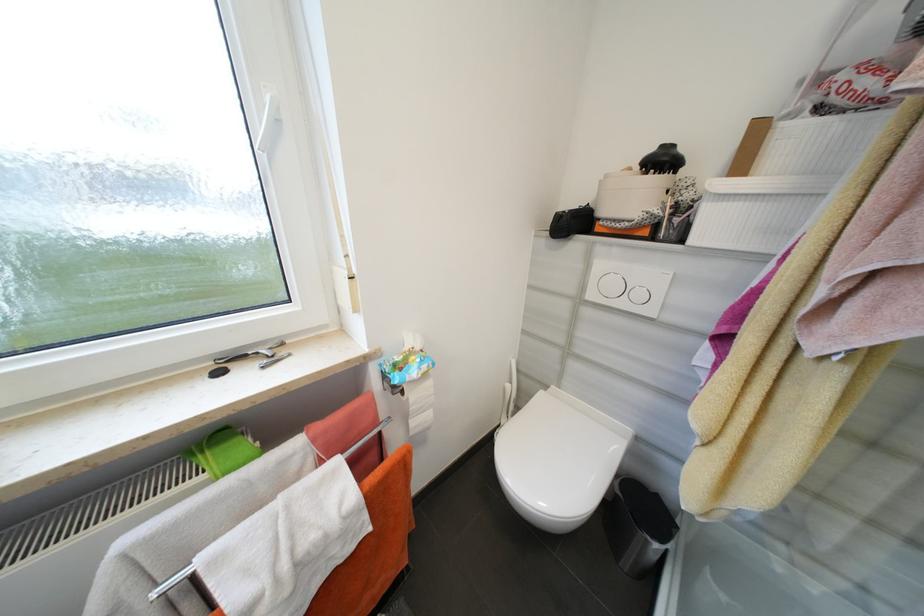
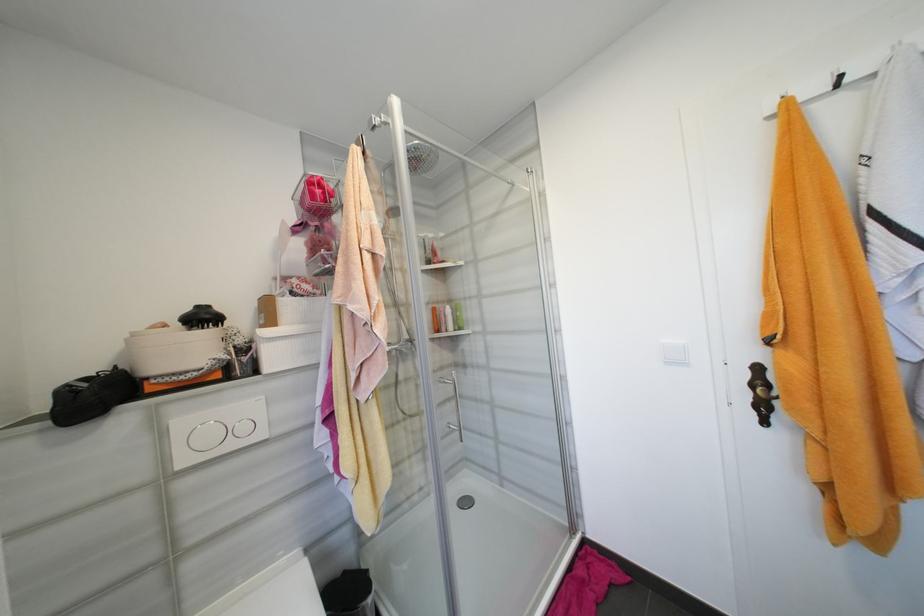
Where in the second image is the point corresponding to [646,296] from the first image?

(249, 429)